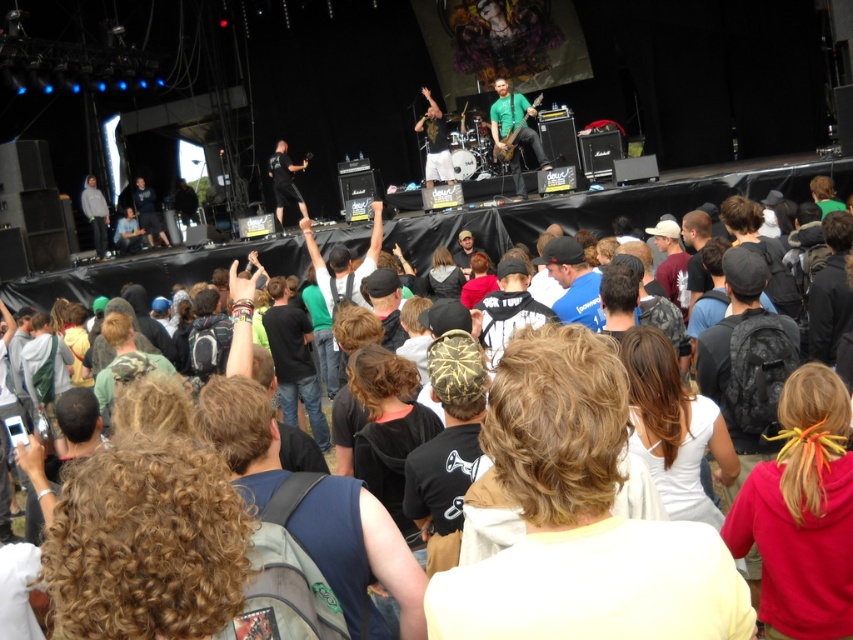
Identify the location of black matte pants at center. The height and width of the screenshot is (640, 853). (285, 180).

Which is more to the left, black matte pants at center or gray hoodie at left?

gray hoodie at left is more to the left.

Does point (277, 161) lie in front of point (103, 221)?

Yes, it is in front of point (103, 221).

Locate an element on the screen. The image size is (853, 640). black matte pants at center is located at coordinates (285, 180).

Is red hoodie at center closer to the viewer compared to green matte shirt at center?

Yes, it is.

Describe the element at coordinates (801, 513) in the screenshot. I see `red hoodie at center` at that location.

Who is more distant from viewer, [790,461] or [497,83]?

Positioned behind is point [497,83].

The width and height of the screenshot is (853, 640). I want to click on red hoodie at center, so click(801, 513).

Does red hoodie at center have a lesser height compared to green fabric shirt at center?

Yes, red hoodie at center is shorter than green fabric shirt at center.

At what (x,y) coordinates should I click in order to perform the action: click on red hoodie at center. Please return your answer as a coordinate pair (x, y). Looking at the image, I should click on [801, 513].